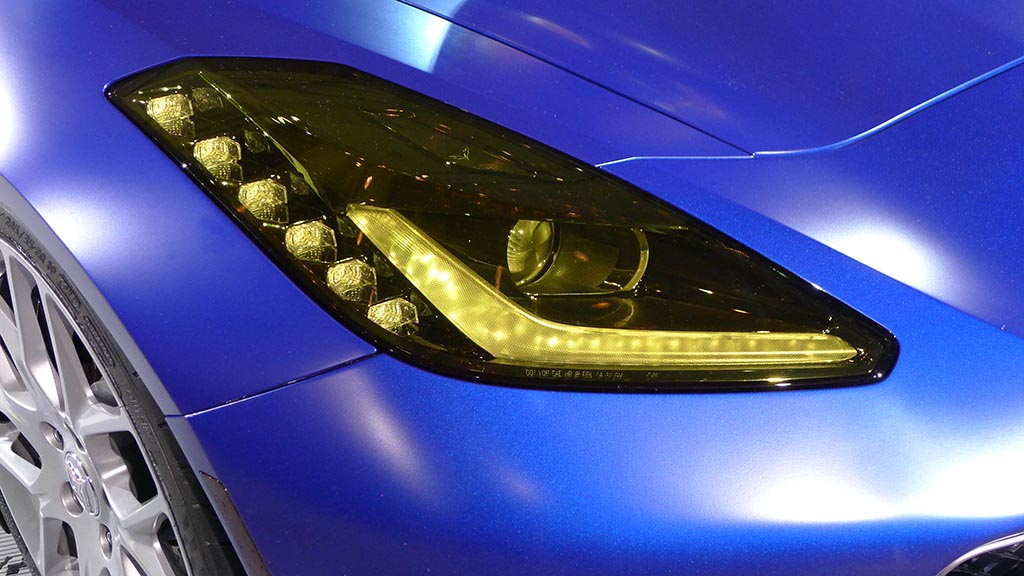
What are the coordinates of `bulbs` in the screenshot? It's located at pyautogui.click(x=392, y=314), pyautogui.click(x=343, y=282), pyautogui.click(x=301, y=233), pyautogui.click(x=261, y=200), pyautogui.click(x=222, y=155), pyautogui.click(x=167, y=112), pyautogui.click(x=518, y=238), pyautogui.click(x=431, y=276), pyautogui.click(x=716, y=350).